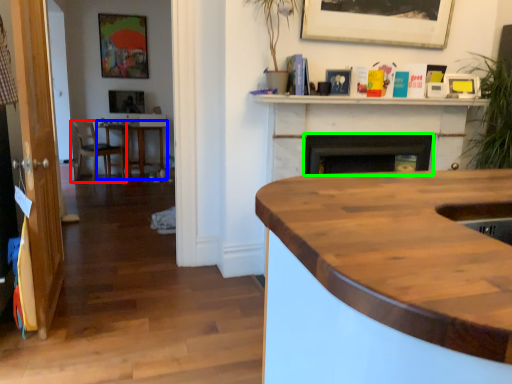
Question: Which object is the farthest from chair (highlighted by a red box)? Choose among these: table (highlighted by a blue box) or fireplace (highlighted by a green box).

Choices:
 (A) table
 (B) fireplace

Answer: (B)